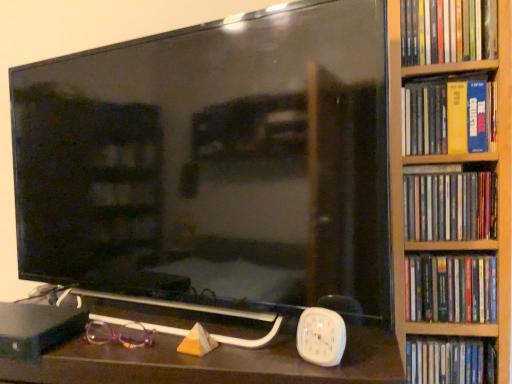
Question: Considering the positions of black glossy tv at center and purple plastic glasses at lower left in the image, is black glossy tv at center wider or thinner than purple plastic glasses at lower left?

Choices:
 (A) wide
 (B) thin

Answer: (A)

Question: From their relative heights in the image, would you say black glossy tv at center is taller or shorter than purple plastic glasses at lower left?

Choices:
 (A) short
 (B) tall

Answer: (B)

Question: Estimate the real-world distances between objects in this image. Which object is farther from the purple plastic glasses at lower left?

Choices:
 (A) hardcover book at right, marked as the second book in a bottom-to-top arrangement
 (B) white plastic dvd case at right, the 5th book in the top-to-bottom sequence
 (C) yellow matte book at right, acting as the 4th book starting from the bottom
 (D) black glossy tv at center
 (E) matte plastic book at right, which is the 1th book from top to bottom

Answer: (E)

Question: Which of these objects is positioned closest to the white plastic clock at lower right?

Choices:
 (A) white plastic dvd case at right, the 1th book when ordered from bottom to top
 (B) purple plastic glasses at lower left
 (C) hardcover book at right, the fourth book when ordered from top to bottom
 (D) matte plastic book at right, the 5th book ordered from the bottom
 (E) yellow matte book at right, acting as the 4th book starting from the bottom

Answer: (C)